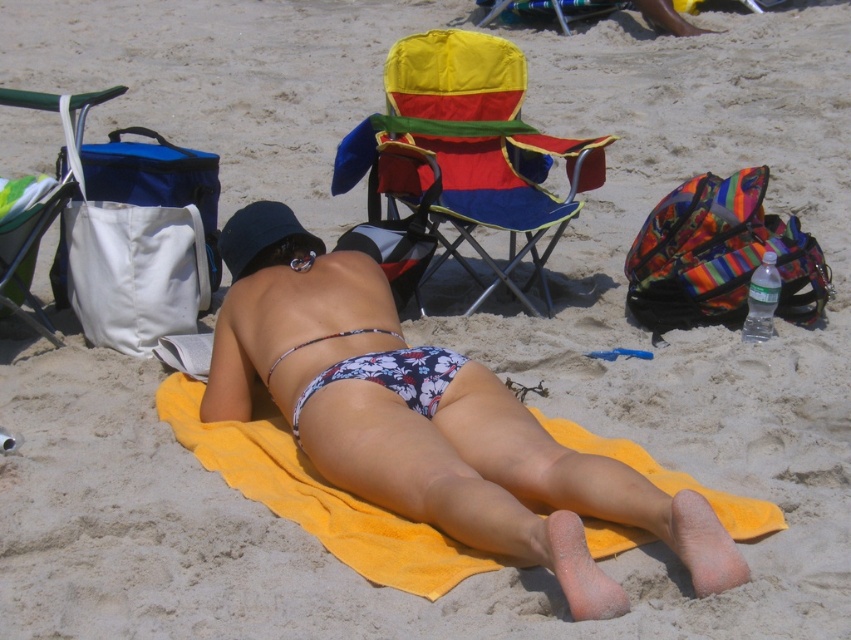
Question: Which object is the farthest from the floral bikini bottom at center?

Choices:
 (A) floral fabric bikini bottom at center
 (B) floral fabric bikini top at center
 (C) white fabric bag at left
 (D) multicolored fabric beach chair at center

Answer: (C)

Question: Is multicolored fabric beach chair at center to the right of floral fabric bikini bottom at center from the viewer's perspective?

Choices:
 (A) yes
 (B) no

Answer: (A)

Question: In this image, where is floral bikini bottom at center located relative to floral fabric bikini top at center?

Choices:
 (A) below
 (B) above

Answer: (A)

Question: Can you confirm if white fabric bag at left is positioned above floral fabric bikini top at center?

Choices:
 (A) yes
 (B) no

Answer: (A)

Question: Among these objects, which one is nearest to the camera?

Choices:
 (A) floral fabric bikini top at center
 (B) floral bikini bottom at center

Answer: (B)

Question: Which object appears closest to the camera in this image?

Choices:
 (A) floral fabric bikini top at center
 (B) multicolored fabric beach chair at center
 (C) white fabric bag at left
 (D) floral fabric bikini bottom at center

Answer: (D)